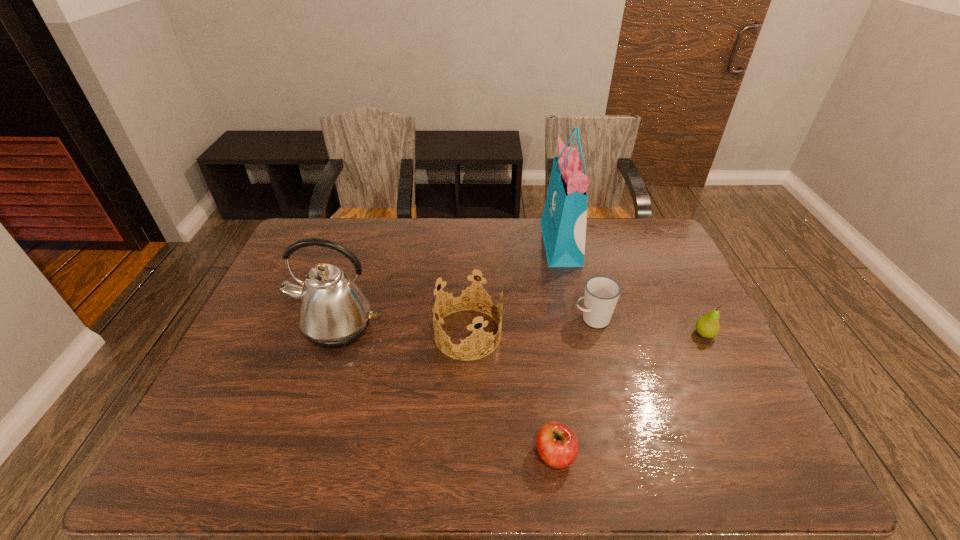
Where is `vacant position in the image that satisfies the following two spatial constraints: 1. with a handle on the side of the cup; 2. from the spout of the fifth shortest object`? The height and width of the screenshot is (540, 960). vacant position in the image that satisfies the following two spatial constraints: 1. with a handle on the side of the cup; 2. from the spout of the fifth shortest object is located at coordinates (595, 327).

Image resolution: width=960 pixels, height=540 pixels. Identify the location of free space that satisfies the following two spatial constraints: 1. on the back side of the fourth shortest object; 2. on the right side of the tallest object. (470, 243).

Locate an element on the screen. vacant space that satisfies the following two spatial constraints: 1. on the front side of the fifth object from right to left; 2. on the left side of the apple is located at coordinates (465, 455).